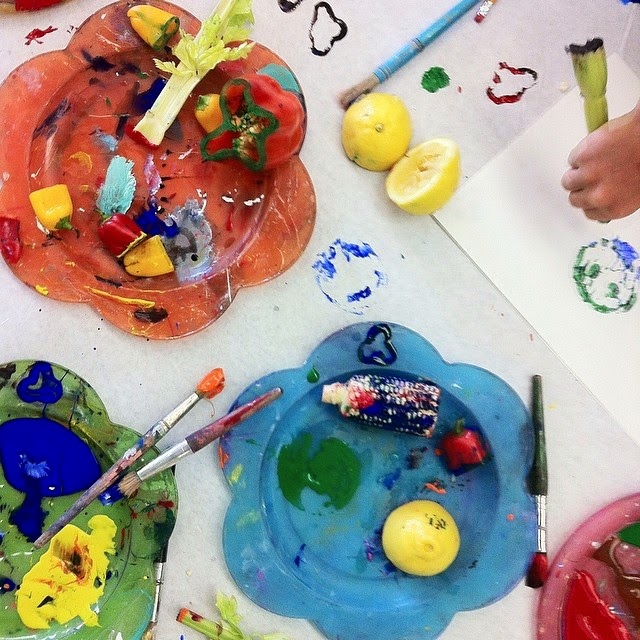
This screenshot has height=640, width=640. In order to click on blue plate in this screenshot , I will do click(315, 548).